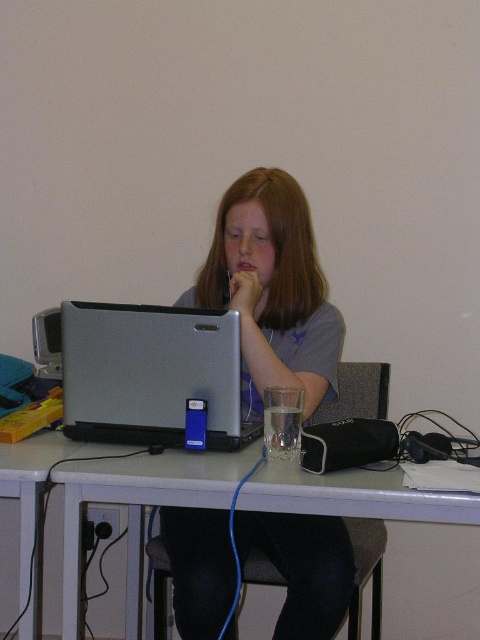
Is matte gray laptop at center closer to the viewer compared to white glossy computer desk at center?

No, matte gray laptop at center is behind white glossy computer desk at center.

Is point (282, 250) more distant than point (86, 467)?

Yes, it is behind point (86, 467).

What do you see at coordinates (272, 291) in the screenshot? This screenshot has width=480, height=640. I see `matte gray laptop at center` at bounding box center [272, 291].

This screenshot has height=640, width=480. I want to click on matte gray laptop at center, so click(272, 291).

Who is shorter, white glossy computer desk at center or silver metallic laptop at center?

silver metallic laptop at center

Can you confirm if white glossy computer desk at center is positioned to the left of silver metallic laptop at center?

Incorrect, white glossy computer desk at center is not on the left side of silver metallic laptop at center.

Image resolution: width=480 pixels, height=640 pixels. Find the location of `white glossy computer desk at center`. white glossy computer desk at center is located at coordinates (137, 508).

The width and height of the screenshot is (480, 640). In order to click on white glossy computer desk at center in this screenshot , I will do tap(137, 508).

Looking at this image, does matte gray laptop at center have a lesser height compared to silver metallic laptop at center?

Incorrect, matte gray laptop at center's height does not fall short of silver metallic laptop at center's.

Identify the location of matte gray laptop at center. (272, 291).

Is point (225, 560) positioned after point (216, 368)?

Yes, it is.

Where is `matte gray laptop at center`? The height and width of the screenshot is (640, 480). matte gray laptop at center is located at coordinates (272, 291).